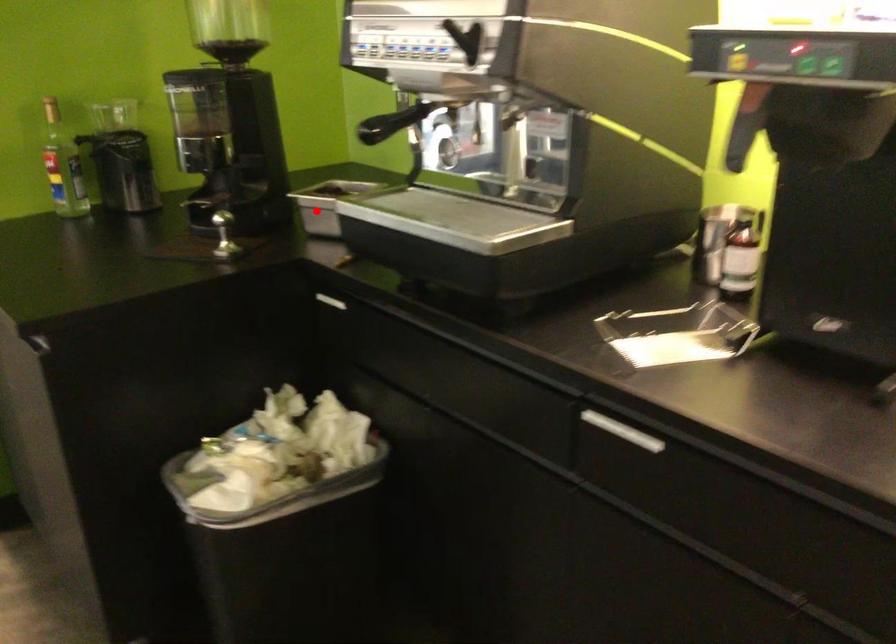
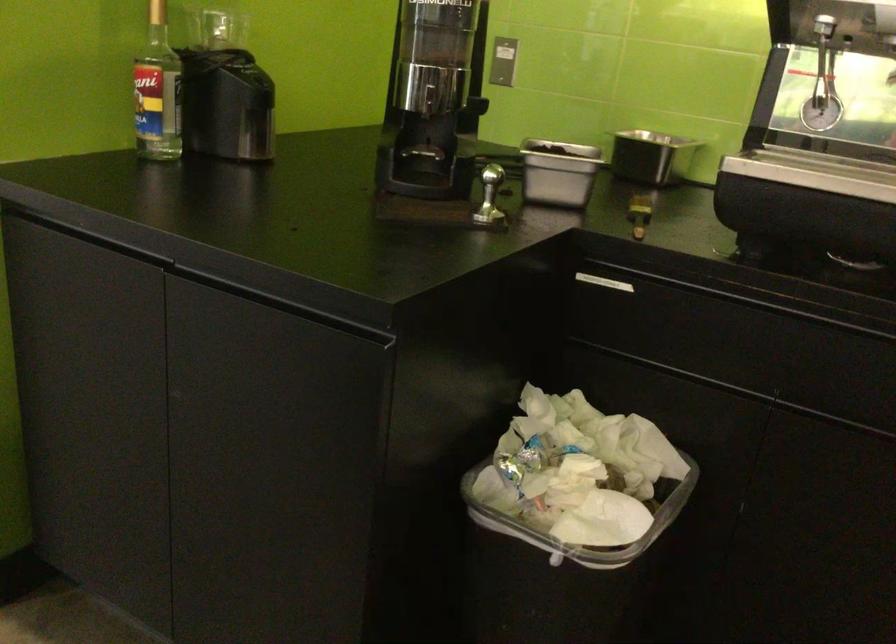
The point at the highlighted location is marked in the first image. Where is the corresponding point in the second image?

(558, 172)